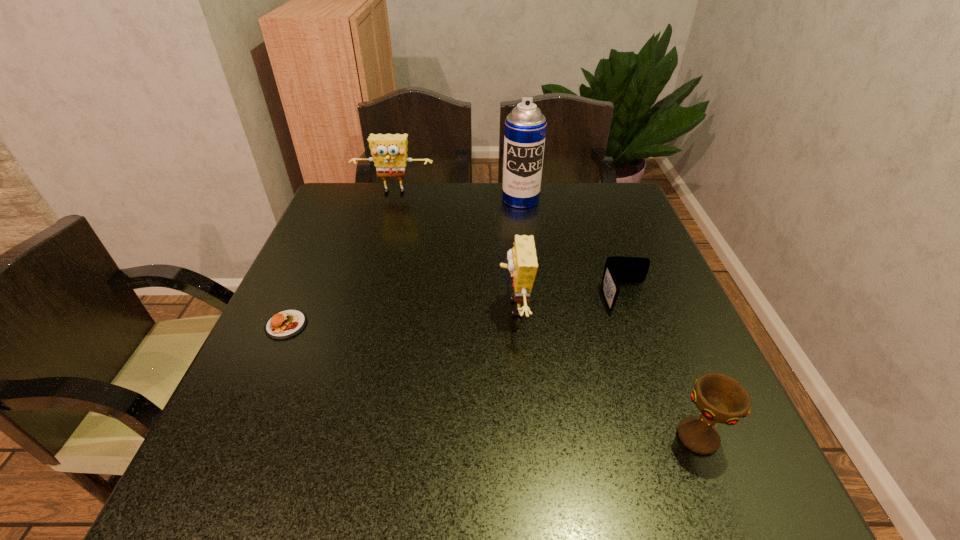
Find the location of `aerosol can`. aerosol can is located at coordinates click(x=525, y=127).

Where is `the left sponge`? This screenshot has height=540, width=960. the left sponge is located at coordinates (389, 151).

I want to click on the right sponge, so click(522, 261).

This screenshot has height=540, width=960. What are the coordinates of `the fourth tallest object` in the screenshot? It's located at (721, 399).

In order to click on chalice in this screenshot , I will do tap(721, 399).

You are a GUI agent. You are given a task and a screenshot of the screen. Output one action in this format:
    pyautogui.click(x=<x>, y=<y>)
    Task: Click on the second shortest object
    This screenshot has width=960, height=540.
    Given the screenshot: What is the action you would take?
    pyautogui.click(x=618, y=269)

The height and width of the screenshot is (540, 960). What are the coordinates of `the shortest object` in the screenshot? It's located at (284, 324).

What are the coordinates of `free space located 0.230m on the label side of the tallest object` in the screenshot? It's located at (528, 258).

Locate an element on the screen. The width and height of the screenshot is (960, 540). blank space located on the face of the left sponge is located at coordinates (389, 214).

The image size is (960, 540). Find the location of `vacant area situated 0.390m on the face of the right sponge`. vacant area situated 0.390m on the face of the right sponge is located at coordinates (325, 308).